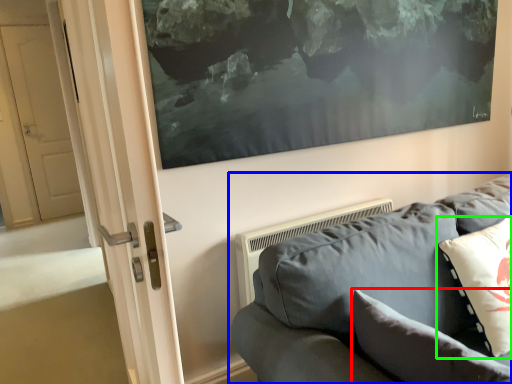
Question: Which object is positioned closest to pillow (highlighted by a red box)? Select from studio couch (highlighted by a blue box) and pillow (highlighted by a green box).

Choices:
 (A) studio couch
 (B) pillow

Answer: (A)